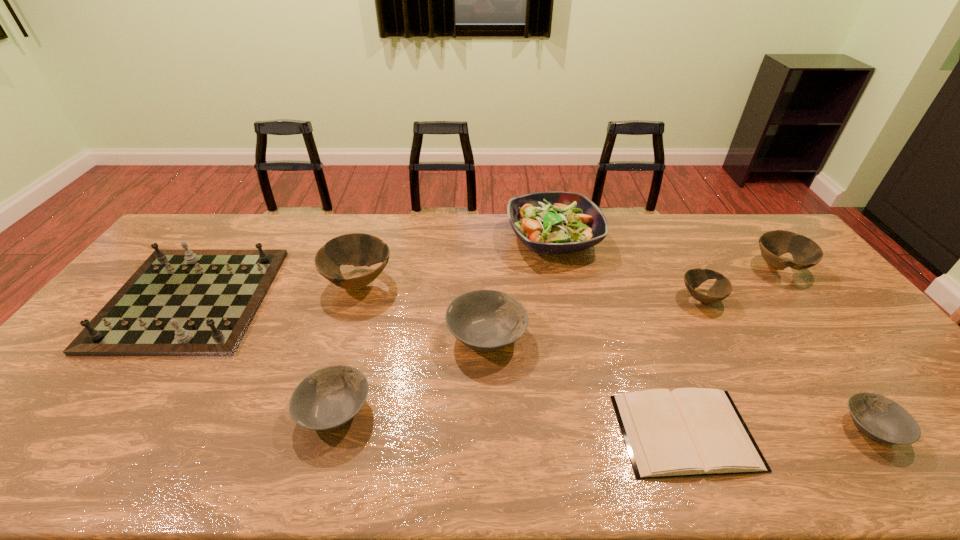
Find the location of a particular element. This screenshot has width=960, height=540. the second smallest gray bowl is located at coordinates (327, 399).

Identify the location of the rightmost gray bowl. The height and width of the screenshot is (540, 960). pyautogui.click(x=881, y=419).

You are a GUI agent. You are given a task and a screenshot of the screen. Output one action in this format:
    pyautogui.click(x=<x>, y=<y>)
    Task: Click on the second shortest object
    The image size is (960, 540).
    Given the screenshot: What is the action you would take?
    pyautogui.click(x=881, y=419)

Where is `hardback book`? The width and height of the screenshot is (960, 540). hardback book is located at coordinates (686, 432).

You are a GUI agent. You are given a task and a screenshot of the screen. Output one action in this format:
    pyautogui.click(x=<x>, y=<y>)
    Task: Click on the shortest object
    This screenshot has height=540, width=960.
    Given the screenshot: What is the action you would take?
    pyautogui.click(x=686, y=432)

You are a GUI agent. You are given a task and a screenshot of the screen. Output one action in this format:
    pyautogui.click(x=<x>, y=<y>)
    Task: Click on the free space located 0.170m on the front of the salad plate
    
    Given the screenshot: What is the action you would take?
    pyautogui.click(x=567, y=306)

This screenshot has height=540, width=960. Identify the location of free region located 0.070m on the left of the leftmost brown bowl. pyautogui.click(x=302, y=282).

Find the location of a particular element. Image resolution: width=960 pixels, height=540 pixels. free space located on the left of the rightmost brown bowl is located at coordinates (657, 268).

Locate an element on the screen. Image resolution: width=960 pixels, height=540 pixels. vacant space located 0.190m on the board of the leftmost object is located at coordinates (x=106, y=420).

Where is `vacant region located 0.070m on the back of the second gray bowl from left to right`? vacant region located 0.070m on the back of the second gray bowl from left to right is located at coordinates (486, 293).